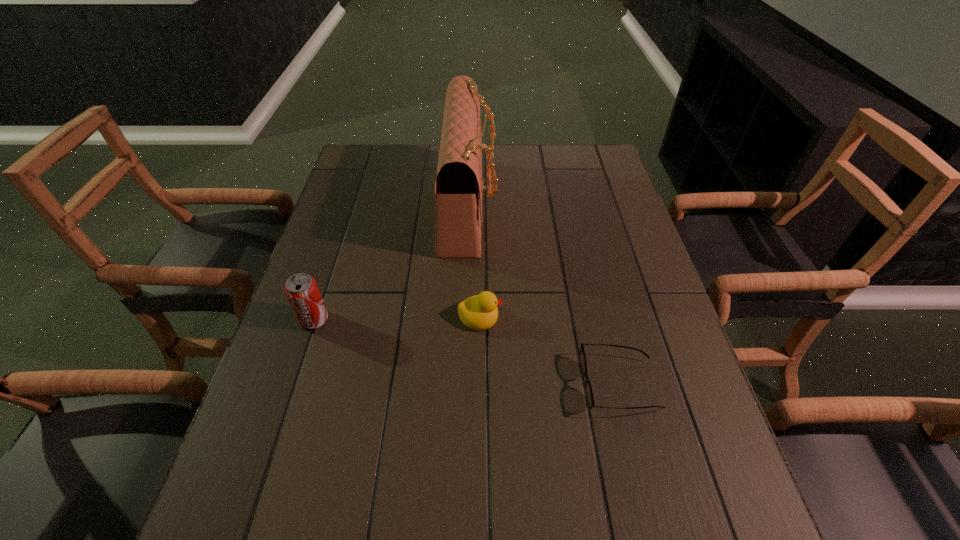
Locate an element on the screen. free space located 0.060m on the face of the rightmost object is located at coordinates pos(554,385).

Find the location of `vacant space situated on the face of the rightmost object`. vacant space situated on the face of the rightmost object is located at coordinates (535, 385).

Image resolution: width=960 pixels, height=540 pixels. Identify the location of free space located 0.240m on the face of the rightmost object. (468, 385).

Identify the location of object that is at the far edge. (459, 188).

I want to click on object at the left edge, so click(301, 290).

Where is `object located at the right edge`? object located at the right edge is located at coordinates (589, 397).

You are a GUI agent. You are given a task and a screenshot of the screen. Output one action in this format:
    pyautogui.click(x=<x>, y=<y>)
    Task: Click on the free space at the far edge of the desktop
    Image resolution: width=960 pixels, height=540 pixels.
    Given the screenshot: What is the action you would take?
    pyautogui.click(x=546, y=150)

Identify the location of vacant space at the near edge of the desktop. (381, 522).

The image size is (960, 540). What are the coordinates of `vacant area at the left edge of the desktop` in the screenshot? It's located at (232, 468).

Identify the location of vacant region at the far right corner of the desktop. (610, 178).